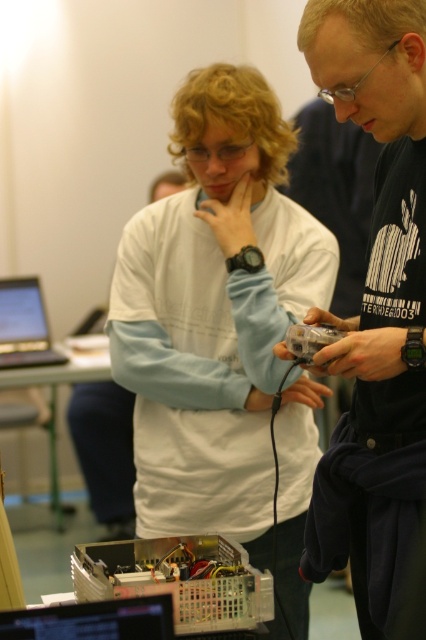
Is black matte shirt at center below metallic circuit board at center?

Actually, black matte shirt at center is above metallic circuit board at center.

Locate an element on the screen. The height and width of the screenshot is (640, 426). black matte shirt at center is located at coordinates (376, 307).

Measure the distance between black matte shirt at center and camera.

black matte shirt at center is 1.20 meters away from camera.

At what (x,y) coordinates should I click in order to perform the action: click on black matte shirt at center. Please return your answer as a coordinate pair (x, y). Image resolution: width=426 pixels, height=640 pixels. Looking at the image, I should click on (376, 307).

Is white matte shirt at center above black glossy laptop at lower left?

Yes, white matte shirt at center is above black glossy laptop at lower left.

Who is positioned more to the right, white matte shirt at center or black glossy laptop at lower left?

From the viewer's perspective, white matte shirt at center appears more on the right side.

What do you see at coordinates (215, 310) in the screenshot? I see `white matte shirt at center` at bounding box center [215, 310].

Identify the location of white matte shirt at center. click(x=215, y=310).

Does metallic circuit board at center appear on the right side of translucent plastic component at center?

Incorrect, metallic circuit board at center is not on the right side of translucent plastic component at center.

From the picture: Is metallic circuit board at center below translucent plastic component at center?

Indeed, metallic circuit board at center is positioned under translucent plastic component at center.

Where is `metallic circuit board at center`? metallic circuit board at center is located at coordinates (178, 580).

Where is `metallic circuit board at center`? The height and width of the screenshot is (640, 426). metallic circuit board at center is located at coordinates (178, 580).